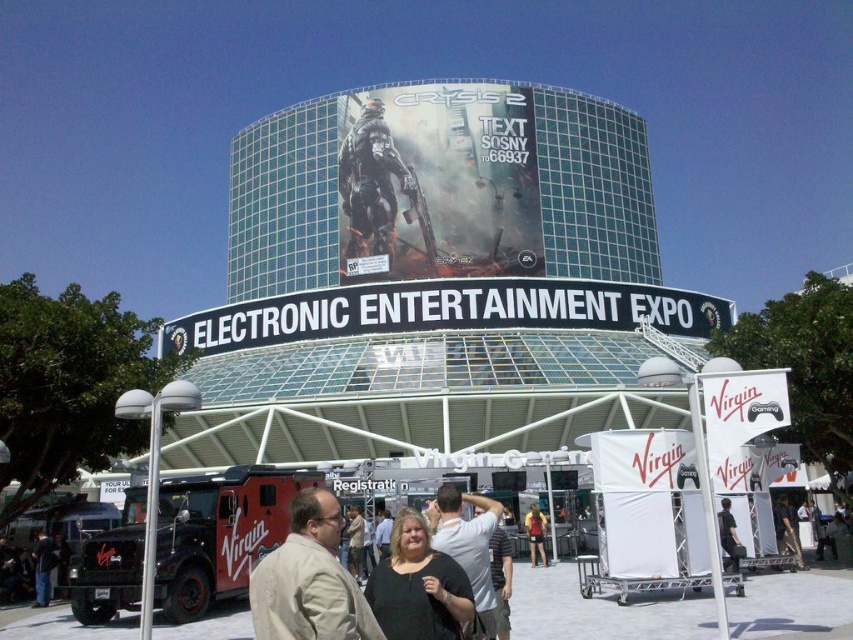
Question: Is white/black text sign at center positioned in front of light gray shirt at center?

Choices:
 (A) yes
 (B) no

Answer: (B)

Question: Which of the following is the closest to the observer?

Choices:
 (A) (329, 586)
 (B) (416, 316)
 (C) (537, 538)
 (D) (418, 582)

Answer: (A)

Question: Is light brown leather jacket at center above yellow fabric shirt at center?

Choices:
 (A) yes
 (B) no

Answer: (A)

Question: Does white/black text sign at center appear under black matte shirt at center?

Choices:
 (A) no
 (B) yes

Answer: (A)

Question: Which point is farther to the camera?

Choices:
 (A) (460, 609)
 (B) (485, 502)
 (C) (534, 509)

Answer: (C)

Question: Which of the following is the farthest from the observer?

Choices:
 (A) light gray shirt at center
 (B) metallic silver poster at center
 (C) black matte shirt at center
 (D) yellow fabric shirt at center

Answer: (B)